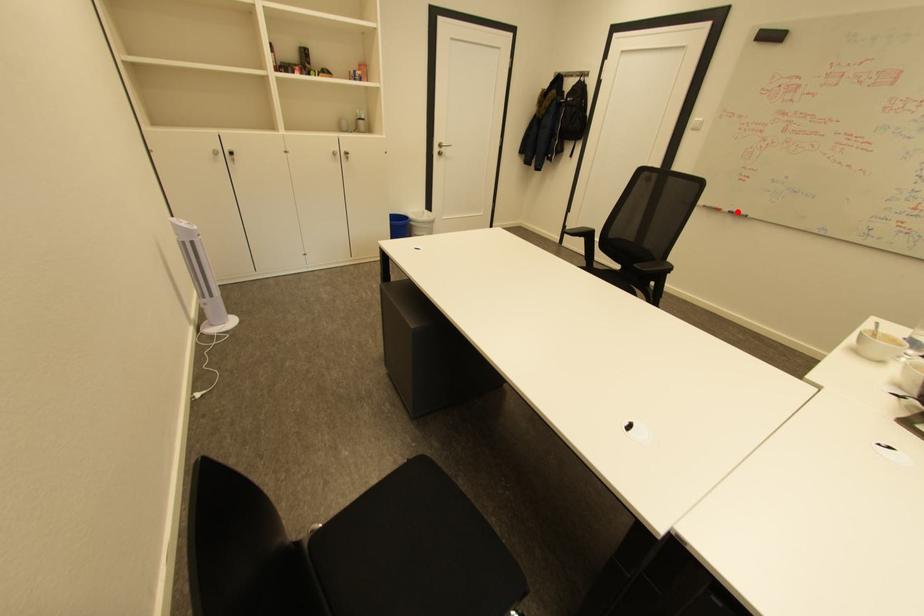
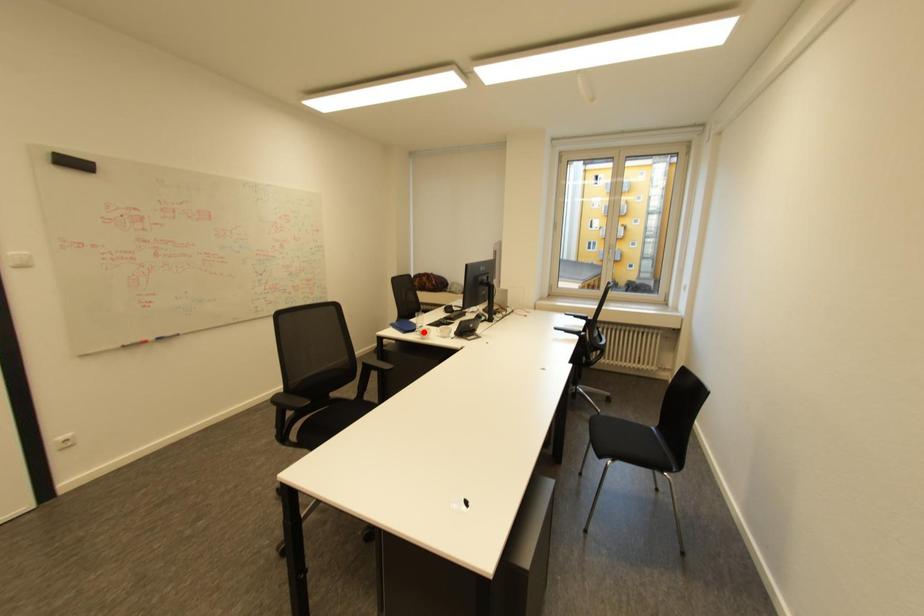
I am providing you with two images of the same scene from different viewpoints. A red point is marked on the first image and another point is marked on the second image. Does the point marked in image1 correspond to the same location as the one in image2?

No